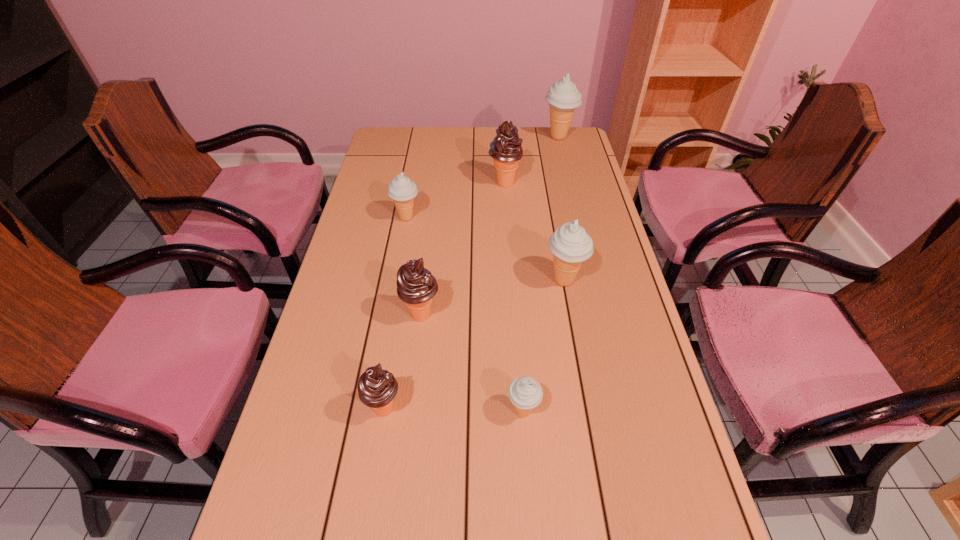
At what (x,y) coordinates should I click in order to perform the action: click on free space that satisfies the following two spatial constraints: 1. on the front side of the second smallest beige icecream; 2. on the left side of the fourth farthest icecream. Please return your answer as a coordinate pair (x, y). Looking at the image, I should click on (396, 280).

Locate an element on the screen. Image resolution: width=960 pixels, height=540 pixels. vacant point that satisfies the following two spatial constraints: 1. on the back side of the nearest beige icecream; 2. on the left side of the third smallest beige icecream is located at coordinates (514, 280).

Where is `vacant space that satisfies the following two spatial constraints: 1. on the front side of the shortest object; 2. on the right side of the leftmost beige icecream`? vacant space that satisfies the following two spatial constraints: 1. on the front side of the shortest object; 2. on the right side of the leftmost beige icecream is located at coordinates (371, 412).